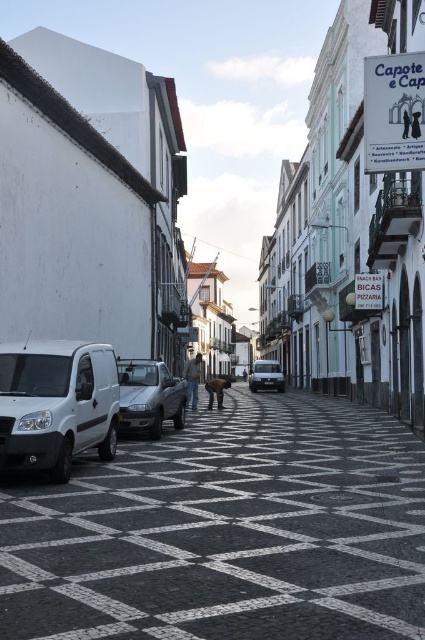
Question: Which object appears farthest from the camera in this image?

Choices:
 (A) matte silver van at center
 (B) silver metallic car at center

Answer: (A)

Question: Where is white matte van at lower left located in relation to silver metallic car at center in the image?

Choices:
 (A) below
 (B) above

Answer: (B)

Question: Estimate the real-world distances between objects in this image. Which object is farther from the silver metallic car at center?

Choices:
 (A) white matte van at lower left
 (B) white glossy van at left

Answer: (A)

Question: From the image, what is the correct spatial relationship of white glossy van at left in relation to silver metallic car at center?

Choices:
 (A) below
 (B) above

Answer: (A)

Question: Observing the image, what is the correct spatial positioning of silver metallic car at center in reference to matte silver van at center?

Choices:
 (A) right
 (B) left

Answer: (B)

Question: Considering the real-world distances, which object is closest to the white matte van at lower left?

Choices:
 (A) white glossy van at left
 (B) silver metallic car at center
 (C) matte silver van at center

Answer: (A)